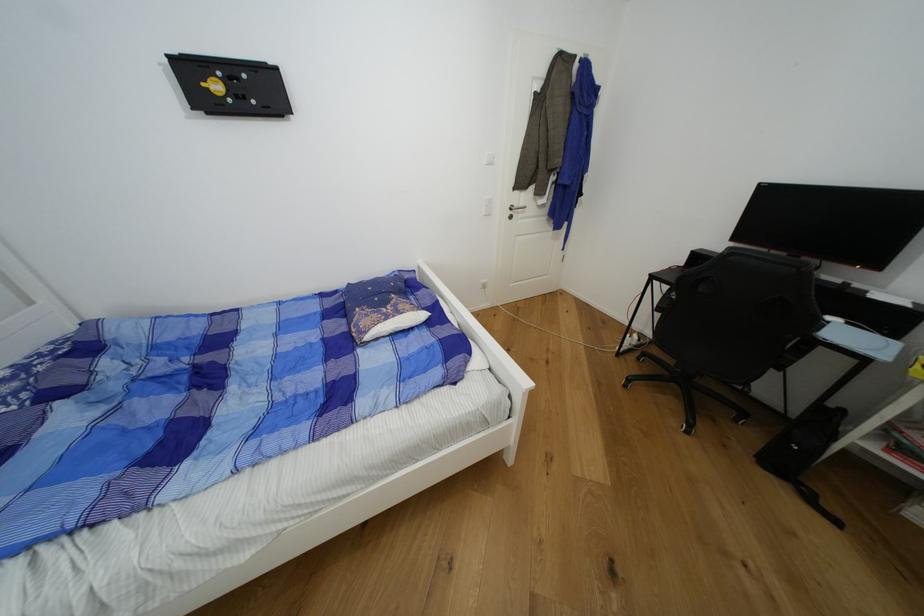
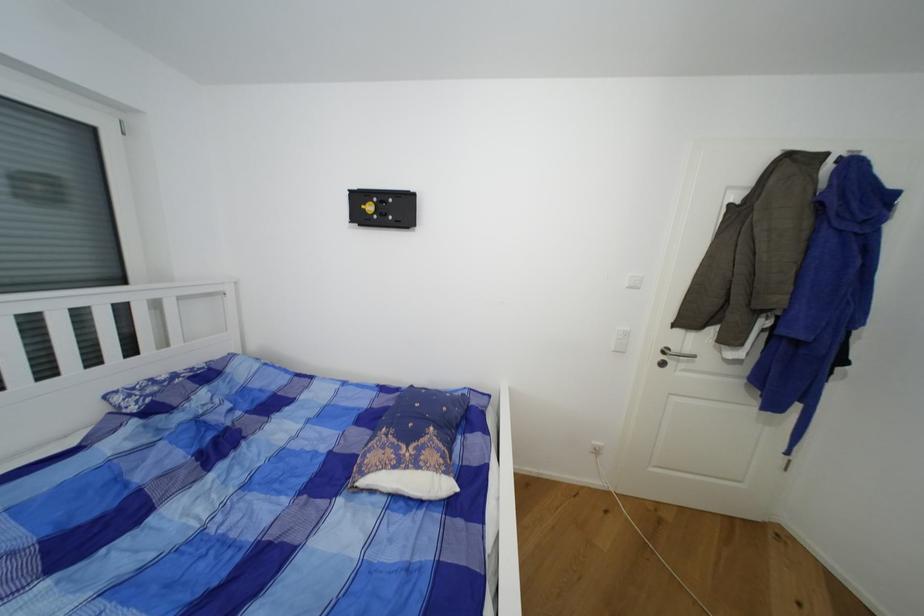
In the second image, find the point that corresponds to (527,207) in the first image.

(691, 352)